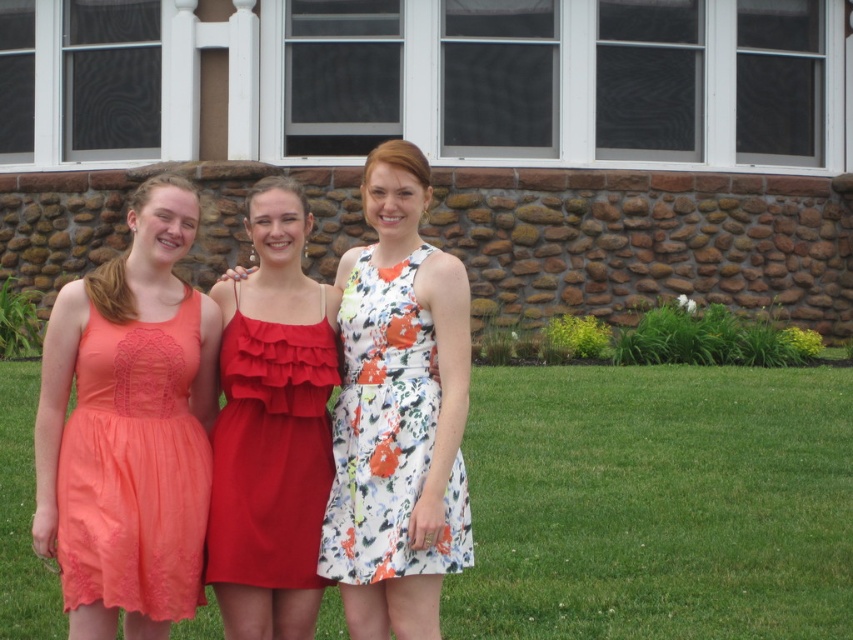
Is green grass at center wider than red satin dress at center?

Yes.

Who is more distant from viewer, [608,500] or [297,330]?

Point [608,500]

What are the coordinates of `green grass at center` in the screenshot? It's located at (657, 502).

Is green grass at center above coral lace dress at left?

No.

Is green grass at center wider than coral lace dress at left?

Yes.

Between point (704, 400) and point (126, 484), which one is positioned behind?

Point (704, 400)

This screenshot has height=640, width=853. I want to click on green grass at center, so click(657, 502).

The width and height of the screenshot is (853, 640). What do you see at coordinates (398, 412) in the screenshot?
I see `floral fabric dress at center` at bounding box center [398, 412].

Is point (379, 568) more distant than point (289, 376)?

That is False.

Where is `floral fabric dress at center`? floral fabric dress at center is located at coordinates (398, 412).